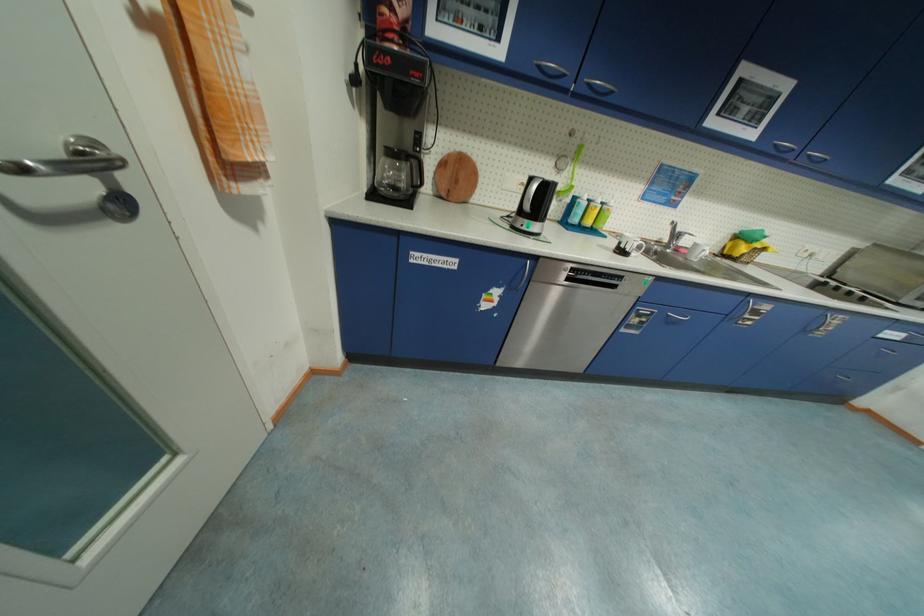
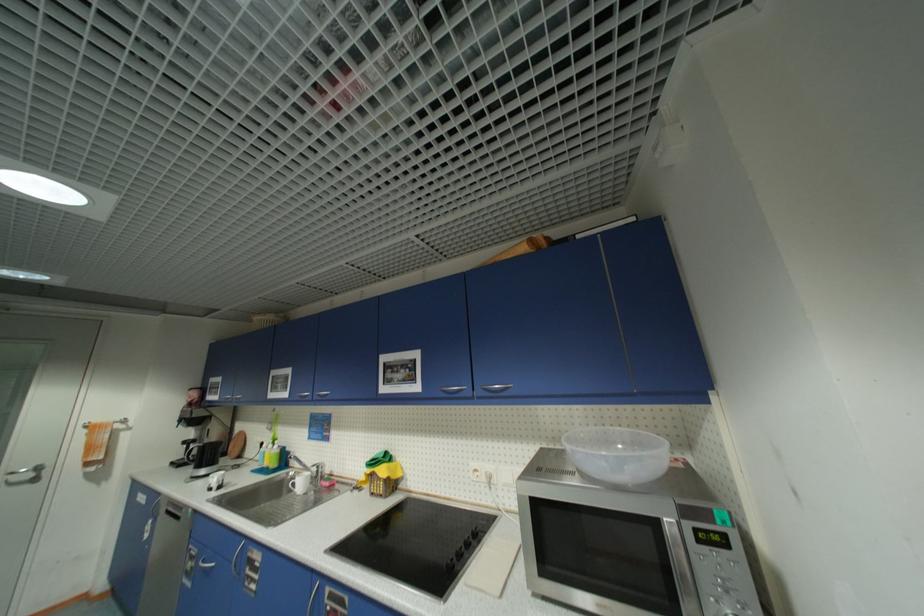
Locate, in the second image, the point that corresponds to (642,321) in the first image.

(196, 565)